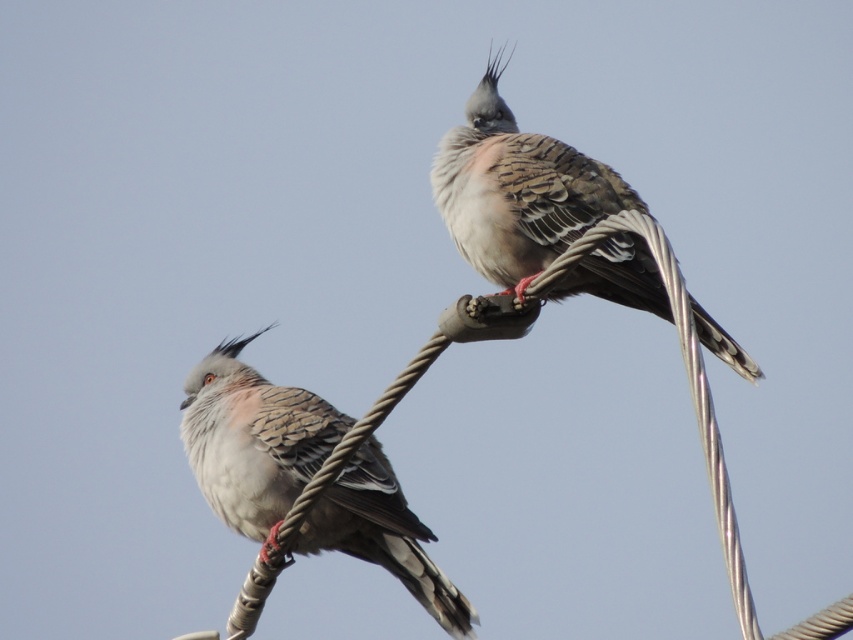
Can you confirm if speckled feathered pigeon at lower left is positioned above speckled feathered bird at upper right?

No, speckled feathered pigeon at lower left is not above speckled feathered bird at upper right.

Who is shorter, speckled feathered pigeon at lower left or speckled feathered bird at upper right?

Standing shorter between the two is speckled feathered bird at upper right.

What do you see at coordinates (253, 440) in the screenshot? I see `speckled feathered pigeon at lower left` at bounding box center [253, 440].

The image size is (853, 640). In order to click on speckled feathered pigeon at lower left in this screenshot , I will do `click(253, 440)`.